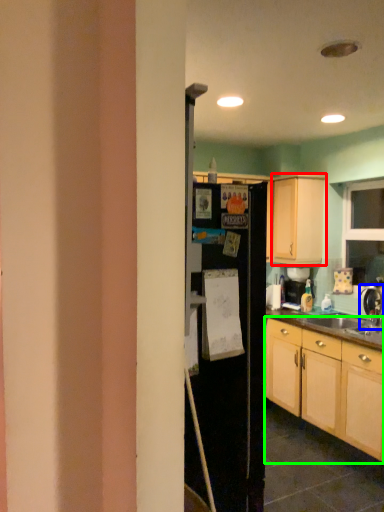
Question: Which is nearer to the cabinetry (highlighted by a red box)? tap (highlighted by a blue box) or cabinetry (highlighted by a green box).

Choices:
 (A) tap
 (B) cabinetry

Answer: (A)